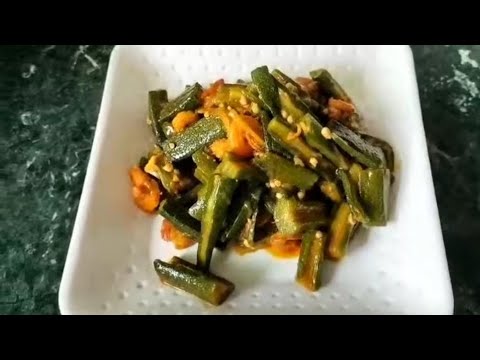
Find the location of a particular element. The height and width of the screenshot is (360, 480). white square plate is located at coordinates (443, 277).